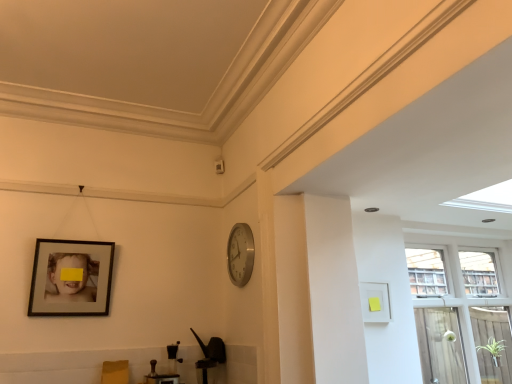
Question: Should I look upward or downward to see matte black picture frame at left, which is the second picture frame in right-to-left order?

Choices:
 (A) up
 (B) down

Answer: (B)

Question: Is clear glass screen door at right thinner than silver metallic clock at center-right?

Choices:
 (A) no
 (B) yes

Answer: (A)

Question: Can you confirm if clear glass screen door at right is wider than silver metallic clock at center-right?

Choices:
 (A) no
 (B) yes

Answer: (B)

Question: Does clear glass screen door at right lie in front of silver metallic clock at center-right?

Choices:
 (A) yes
 (B) no

Answer: (B)

Question: Is clear glass screen door at right smaller than silver metallic clock at center-right?

Choices:
 (A) yes
 (B) no

Answer: (B)

Question: Could you tell me if clear glass screen door at right is turned towards silver metallic clock at center-right?

Choices:
 (A) yes
 (B) no

Answer: (B)

Question: From a real-world perspective, is clear glass screen door at right positioned under silver metallic clock at center-right based on gravity?

Choices:
 (A) no
 (B) yes

Answer: (B)

Question: From the image's perspective, is matte black picture frame at left, which is the second picture frame in right-to-left order, on clear glass screen door at right?

Choices:
 (A) no
 (B) yes

Answer: (B)

Question: Considering the relative sizes of matte black picture frame at left, the 1th picture frame when ordered from left to right, and clear glass screen door at right in the image provided, is matte black picture frame at left, the 1th picture frame when ordered from left to right, smaller than clear glass screen door at right?

Choices:
 (A) no
 (B) yes

Answer: (A)

Question: Can you confirm if matte black picture frame at left, the 1th picture frame when ordered from left to right, is shorter than clear glass screen door at right?

Choices:
 (A) no
 (B) yes

Answer: (B)

Question: Is matte black picture frame at left, which is the second picture frame in right-to-left order, wider than clear glass screen door at right?

Choices:
 (A) yes
 (B) no

Answer: (B)

Question: Is matte black picture frame at left, the 1th picture frame when ordered from left to right, outside clear glass screen door at right?

Choices:
 (A) no
 (B) yes

Answer: (B)

Question: Is clear glass screen door at right at the back of matte black picture frame at left, the 1th picture frame when ordered from left to right?

Choices:
 (A) yes
 (B) no

Answer: (B)

Question: Is silver metallic clock at center-right facing away from transparent glass window at right?

Choices:
 (A) no
 (B) yes

Answer: (B)